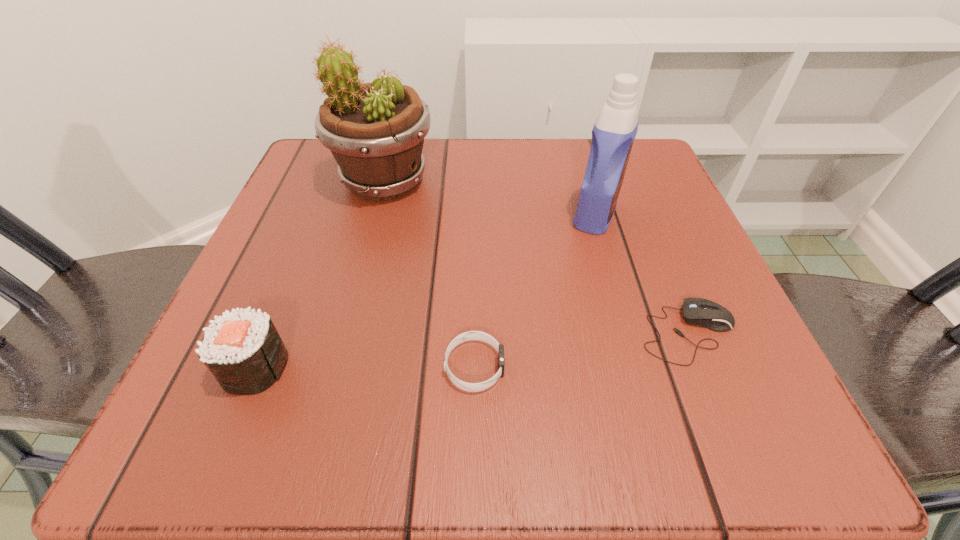
Where is `empty space that is in between the detergent and the third object from right to left`? The image size is (960, 540). empty space that is in between the detergent and the third object from right to left is located at coordinates (535, 291).

Identify the location of vacant point located between the computer mouse and the flowerpot. pyautogui.click(x=537, y=258).

Find the location of a particular element. blank region between the sushi and the flowerpot is located at coordinates (320, 274).

This screenshot has width=960, height=540. Find the location of `empty location between the detergent and the third object from right to left`. empty location between the detergent and the third object from right to left is located at coordinates (535, 291).

This screenshot has width=960, height=540. Identify the location of free spot between the flowerpot and the wristband. click(x=429, y=274).

Locate an element on the screen. blank region between the detergent and the sushi is located at coordinates (425, 291).

Locate an element on the screen. Image resolution: width=960 pixels, height=540 pixels. free area in between the sushi and the computer mouse is located at coordinates (472, 350).

Choose which object is the fourth nearest neighbor to the computer mouse. Please provide its 2D coordinates. Your answer should be formatted as a tuple, i.e. [(x, y)], where the tuple contains the x and y coordinates of a point satisfying the conditions above.

[(244, 352)]

The height and width of the screenshot is (540, 960). I want to click on object identified as the second closest to the computer mouse, so click(x=471, y=335).

The height and width of the screenshot is (540, 960). In order to click on free spot that satisfies the following two spatial constraints: 1. on the front side of the detergent; 2. on the outer surface of the third object from right to left in this screenshot , I will do `click(639, 367)`.